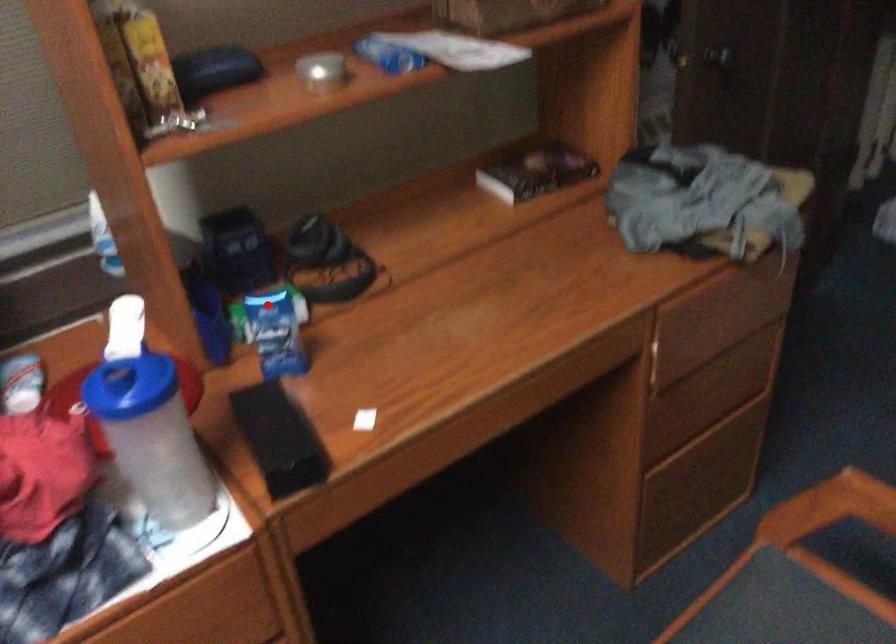
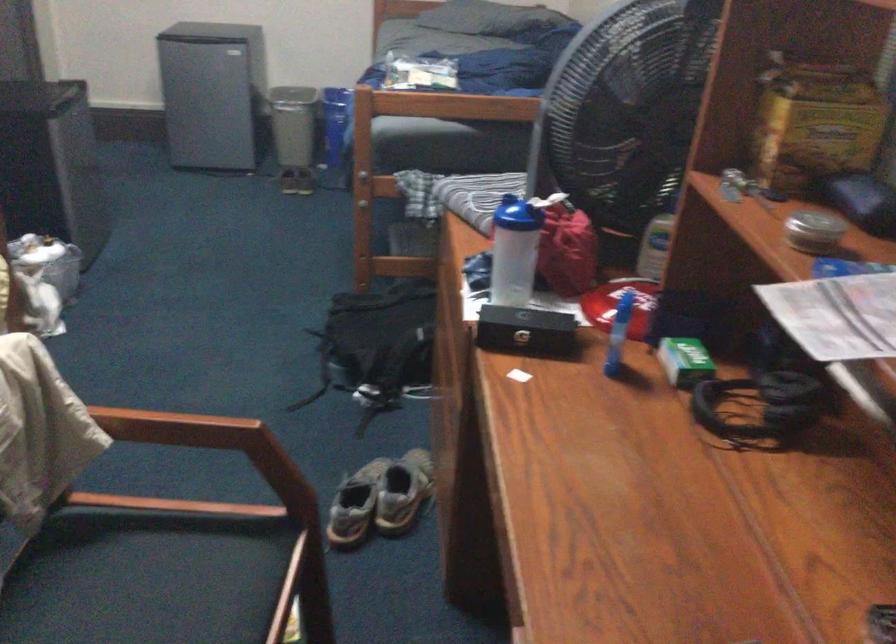
Locate, in the second image, the point that corresponds to the highlighted location in the first image.

(685, 361)